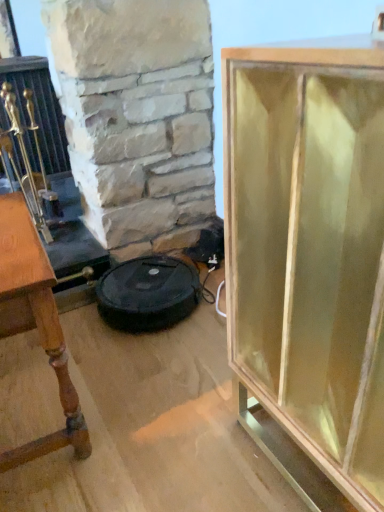
Describe the element at coordinates (35, 324) in the screenshot. I see `wooden table at left` at that location.

Where is `wooden table at left`? The image size is (384, 512). wooden table at left is located at coordinates (35, 324).

Identify the location of wooden table at left. This screenshot has height=512, width=384. (35, 324).